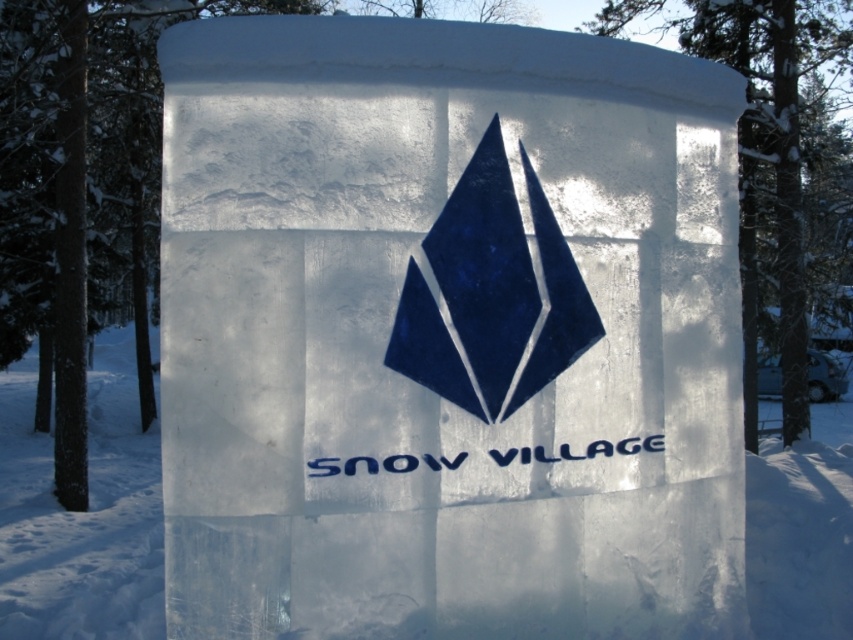
Consider the image. You are an artist trying to recreate the Snow Village logo. You have two main elements to place on your canvas. Which element should you place first if you want to ensure the blue glossy diamond at center is on the left side of the transparent ice at center?

The blue glossy diamond at center should be placed first on the left side so that the transparent ice at center can be positioned to its right, maintaining their correct spatial relationship as described.

You are an artist planning to place a 10 cm wide decorative snowflake on the transparent ice at center. The snowflake must not overlap with the blue glossy diamond at center. Can the snowflake fit without overlapping?

The transparent ice at center is wider than the blue glossy diamond at center. Since the snowflake is 10 cm wide, it can be placed on the transparent ice at center without overlapping the blue glossy diamond at center as long as it stays within the ice area.

You are a visitor at the Snow Village and want to take a photo of the ice sculpture. The transparent ice at center and the blue glossy diamond at center are both part of the sculpture. Which object should you focus on first if you want to capture the glowing edges caused by light passing through the ice?

The transparent ice at center should be focused on first because it is located below the blue glossy diamond at center, and since light passes through the transparent ice, its edges will glow more visibly.